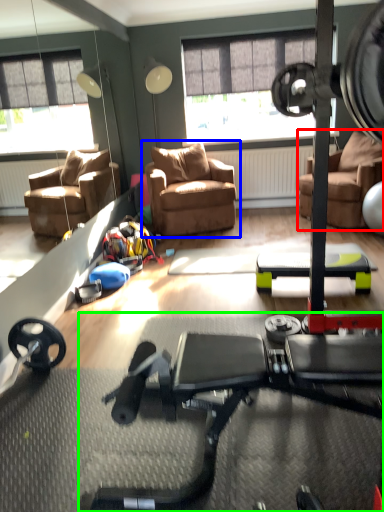
Question: Based on their relative distances, which object is nearer to chair (highlighted by a red box)? Choose from chair (highlighted by a blue box) and stationary bicycle (highlighted by a green box).

Choices:
 (A) chair
 (B) stationary bicycle

Answer: (A)